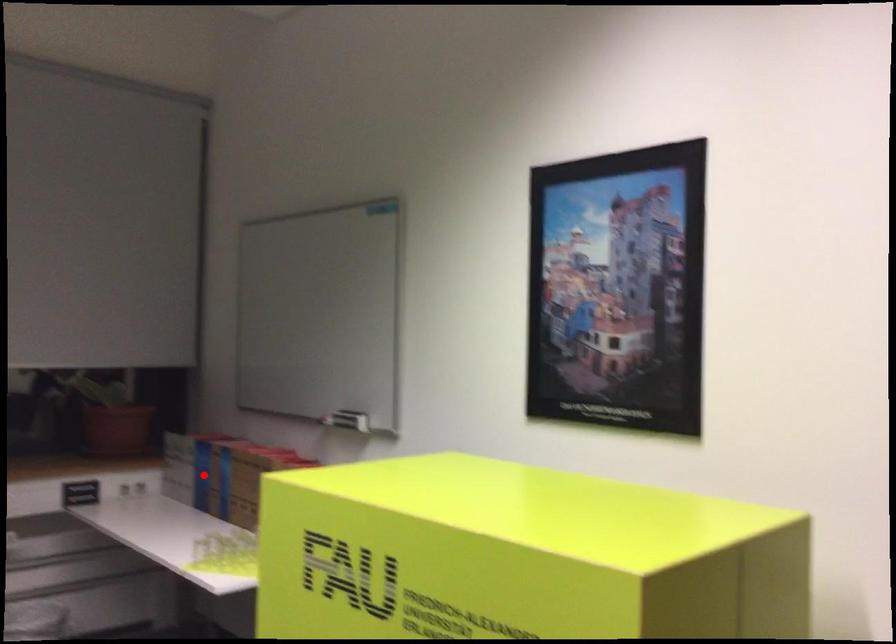
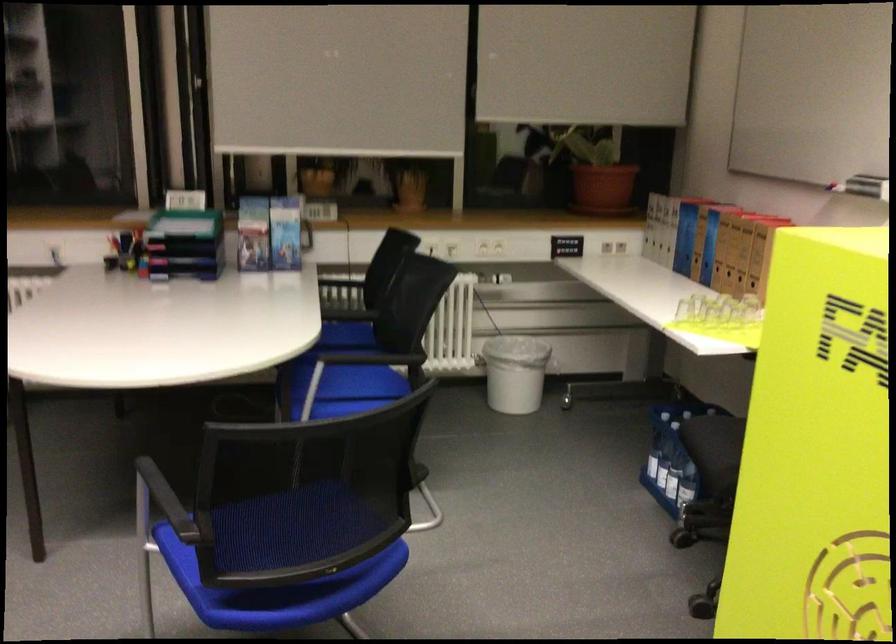
Find the pixel in the second image that matches the highlighted location in the first image.

(685, 238)